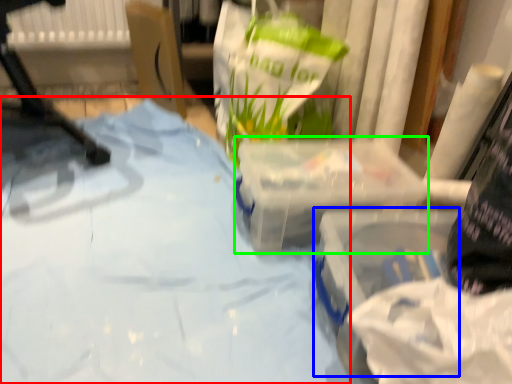
Question: Estimate the real-world distances between objects in this image. Which object is closer to sheet (highlighted by a red box), box (highlighted by a blue box) or box (highlighted by a green box)?

Choices:
 (A) box
 (B) box

Answer: (B)